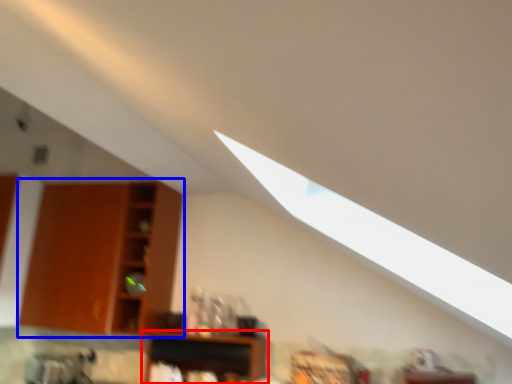
Question: Which object is further to the camera taking this photo, shelf (highlighted by a red box) or shelf (highlighted by a blue box)?

Choices:
 (A) shelf
 (B) shelf

Answer: (B)